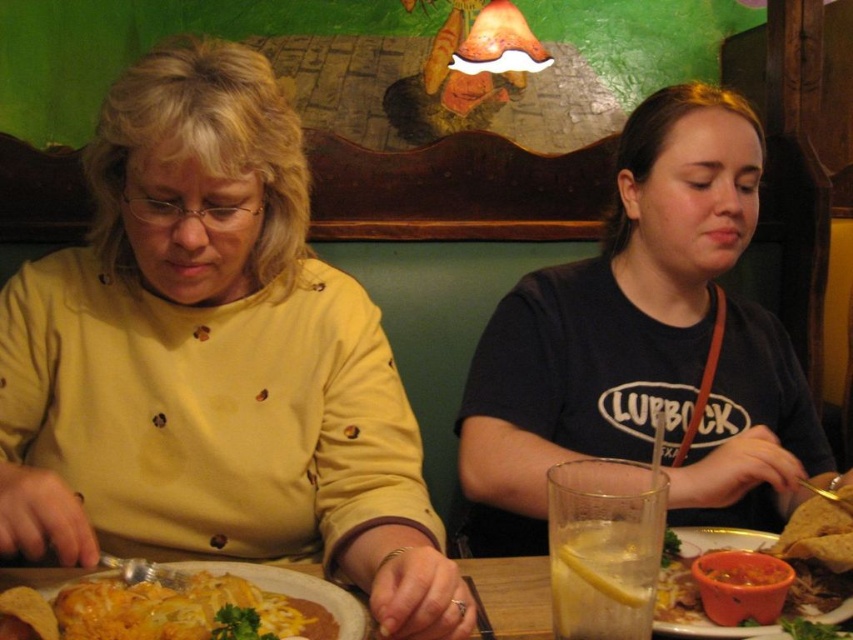
You are a photographer trying to capture a closeup of the cheesy tortilla at lower left without the yellow matte shirt at center blocking the view. Is it possible to take the photo from your current position?

The cheesy tortilla at lower left is behind the yellow matte shirt at center, so it is blocked from view. You cannot take a photo of the cheesy tortilla at lower left from your current position without moving the yellow matte shirt at center.

Please provide the 2D coordinates of the yellow matte shirt at center in the image. The coordinates should be in the format of a tuple with two decimal numbers separated by a comma, enclosed in parentheses.

The 2D coordinates of the yellow matte shirt at center are at point [212,362], so the answer is [212,362].

Looking at this image, you are a waiter in a restaurant and need to deliver a drink to the person sitting at the wooden table at center. Which side of the table should you approach to find the person wearing the yellow matte shirt at center?

The yellow matte shirt at center is positioned on the left side of wooden table at center, so you should approach the left side of the wooden table at center to find the person wearing it.